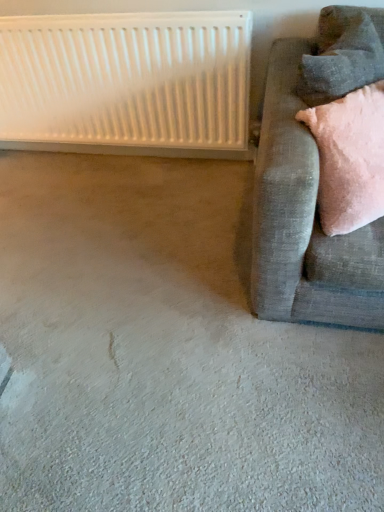
Describe the element at coordinates (314, 182) in the screenshot. I see `velvet grey couch at right` at that location.

At what (x,y) coordinates should I click in order to perform the action: click on velvet gray pillow at upper right. Please return your answer as a coordinate pair (x, y). This screenshot has height=512, width=384. Looking at the image, I should click on (342, 54).

I want to click on velvet grey couch at right, so click(x=314, y=182).

Between white plastic radiator at upper left and velvet grey couch at right, which one appears on the left side from the viewer's perspective?

white plastic radiator at upper left.

Is white plastic radiator at upper left in front of or behind velvet grey couch at right in the image?

In the image, white plastic radiator at upper left appears behind velvet grey couch at right.

This screenshot has height=512, width=384. I want to click on studio couch lying below the white plastic radiator at upper left (from the image's perspective), so click(314, 182).

Between white plastic radiator at upper left and velvet grey couch at right, which one has smaller width?

Thinner between the two is white plastic radiator at upper left.

Is velvet gray pillow at upper right spatially inside white plastic radiator at upper left, or outside of it?

velvet gray pillow at upper right lies outside white plastic radiator at upper left.

From a real-world perspective, which is physically below, velvet gray pillow at upper right or white plastic radiator at upper left?

white plastic radiator at upper left.

Is velvet grey couch at right looking in the opposite direction of velvet gray pillow at upper right?

velvet grey couch at right does not have its back to velvet gray pillow at upper right.

Is velvet gray pillow at upper right inside velvet grey couch at right?

Absolutely, velvet gray pillow at upper right is inside velvet grey couch at right.

Which object is further away from the camera, velvet gray pillow at upper right or velvet grey couch at right?

Positioned behind is velvet gray pillow at upper right.

Is velvet gray pillow at upper right far from velvet grey couch at right?

No, velvet gray pillow at upper right is not far from velvet grey couch at right.

You are a GUI agent. You are given a task and a screenshot of the screen. Output one action in this format:
    pyautogui.click(x=<x>, y=<y>)
    Task: Click on the studio couch on the right of the velvet gray pillow at upper right
    The height and width of the screenshot is (512, 384).
    Given the screenshot: What is the action you would take?
    pyautogui.click(x=314, y=182)

Is velvet gray pillow at upper right wider than velvet grey couch at right?

No.

Between velvet grey couch at right and white plastic radiator at upper left, which one has less height?

white plastic radiator at upper left.

Is velvet grey couch at right wider or thinner than white plastic radiator at upper left?

Considering their sizes, velvet grey couch at right looks broader than white plastic radiator at upper left.

From the picture: Can we say velvet grey couch at right lies outside white plastic radiator at upper left?

Yes, velvet grey couch at right is located beyond the bounds of white plastic radiator at upper left.

Is white plastic radiator at upper left at the right side of velvet gray pillow at upper right?

No.

Considering the positions of point (51, 135) and point (375, 38), is point (51, 135) closer or farther from the camera than point (375, 38)?

Point (51, 135) is positioned farther from the camera compared to point (375, 38).

Which is behind, white plastic radiator at upper left or velvet gray pillow at upper right?

white plastic radiator at upper left is more distant.

Does white plastic radiator at upper left touch velvet gray pillow at upper right?

No, white plastic radiator at upper left is not with velvet gray pillow at upper right.

Find the location of a particular element. The image size is (384, 512). radiator on the left of velvet grey couch at right is located at coordinates (127, 83).

The image size is (384, 512). Identify the location of radiator located behind the velvet gray pillow at upper right. (127, 83).

Looking at the image, which one is located further to white plastic radiator at upper left, velvet grey couch at right or velvet gray pillow at upper right?

velvet gray pillow at upper right.

Estimate the real-world distances between objects in this image. Which object is closer to velvet gray pillow at upper right, velvet grey couch at right or white plastic radiator at upper left?

The object closer to velvet gray pillow at upper right is velvet grey couch at right.

Looking at the image, which one is located further to velvet grey couch at right, velvet gray pillow at upper right or white plastic radiator at upper left?

The object further to velvet grey couch at right is white plastic radiator at upper left.

When comparing their distances from velvet gray pillow at upper right, does white plastic radiator at upper left or velvet grey couch at right seem further?

The object further to velvet gray pillow at upper right is white plastic radiator at upper left.

Estimate the real-world distances between objects in this image. Which object is closer to white plastic radiator at upper left, velvet gray pillow at upper right or velvet grey couch at right?

velvet grey couch at right is positioned closer to the anchor white plastic radiator at upper left.

Which object lies further to the anchor point velvet grey couch at right, white plastic radiator at upper left or velvet gray pillow at upper right?

The object further to velvet grey couch at right is white plastic radiator at upper left.

The height and width of the screenshot is (512, 384). Identify the location of pillow situated between white plastic radiator at upper left and velvet grey couch at right from left to right. (342, 54).